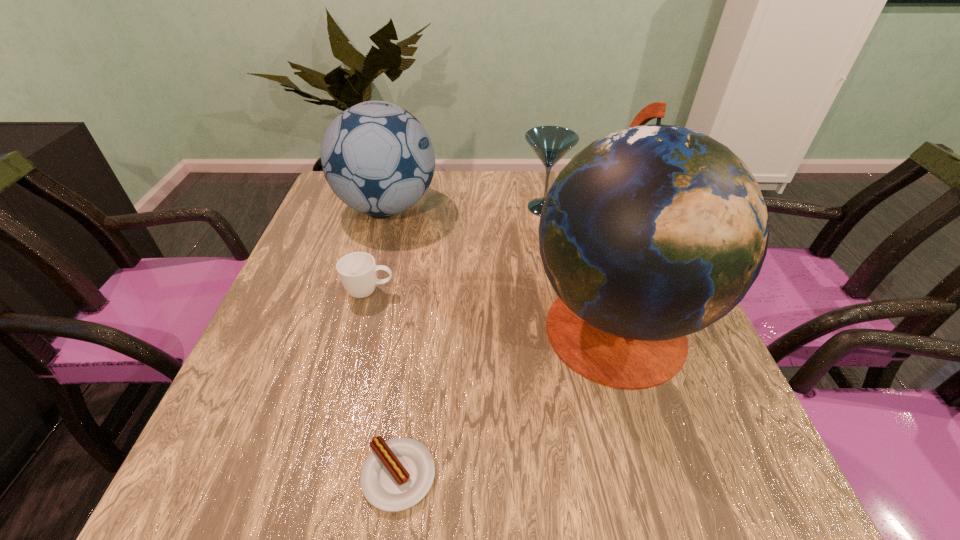
The width and height of the screenshot is (960, 540). In order to click on free space that satisfies the following two spatial constraints: 1. on the side with brand of the shortest object; 2. on the right side of the soccer ball in this screenshot , I will do coord(311,476).

At what (x,y) coordinates should I click in order to perform the action: click on vacant space that satisfies the following two spatial constraints: 1. on the side with brand of the soccer ball; 2. on the right side of the sausage. Please return your answer as a coordinate pair (x, y). This screenshot has height=540, width=960. Looking at the image, I should click on (311, 476).

Image resolution: width=960 pixels, height=540 pixels. I want to click on free space that satisfies the following two spatial constraints: 1. on the side with brand of the martini; 2. on the right side of the soccer ball, so click(387, 208).

The image size is (960, 540). I want to click on free space that satisfies the following two spatial constraints: 1. on the back side of the sausage; 2. with the handle on the side of the second shortest object, so click(x=423, y=292).